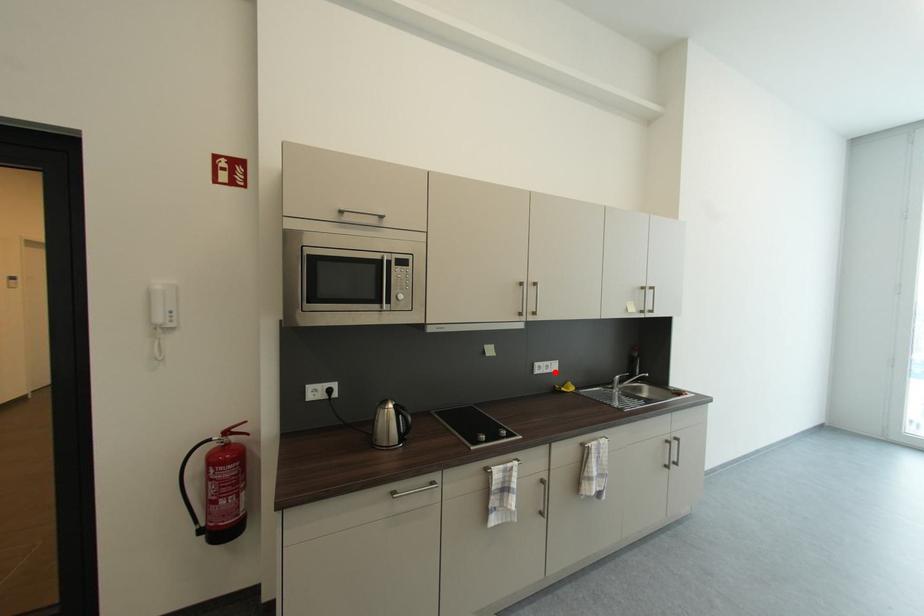
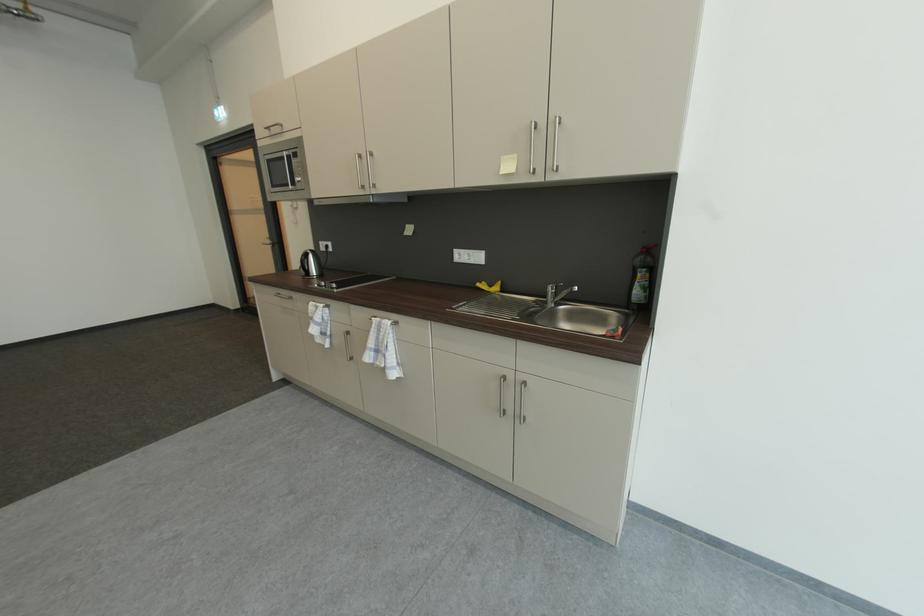
Where in the second image is the point corresponding to the highlighted location from the first image?

(479, 262)